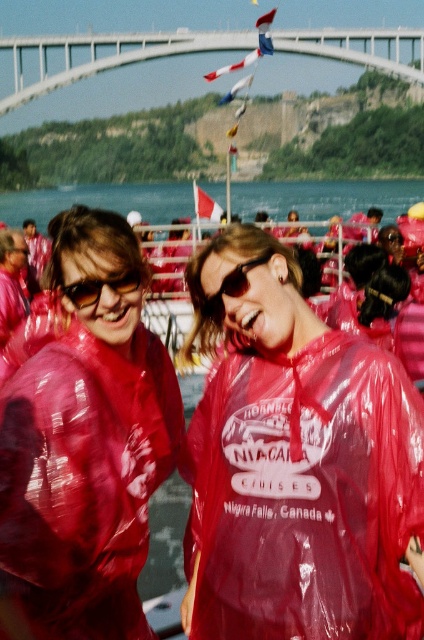
What is located at the coordinates point (298, 467)?

The transparent plastic raincoat at center is located at point (298, 467).

You are a photographer trying to capture a clear shot of the sunglasses at center without the glossy plastic poncho at center blocking the view. Based on their sizes, is this possible?

The glossy plastic poncho at center is taller than the sunglasses at center, so it might block the view of the sunglasses at center unless adjusted.

In the scene shown: You are a photographer trying to capture the participants in their red raincoats. You notice the glossy plastic poncho at center and the sunglasses at center. Which object is positioned to the right side of the other?

The sunglasses at center are positioned to the right of the glossy plastic poncho at center because the glossy plastic poncho at center is to the left of sunglasses at center.